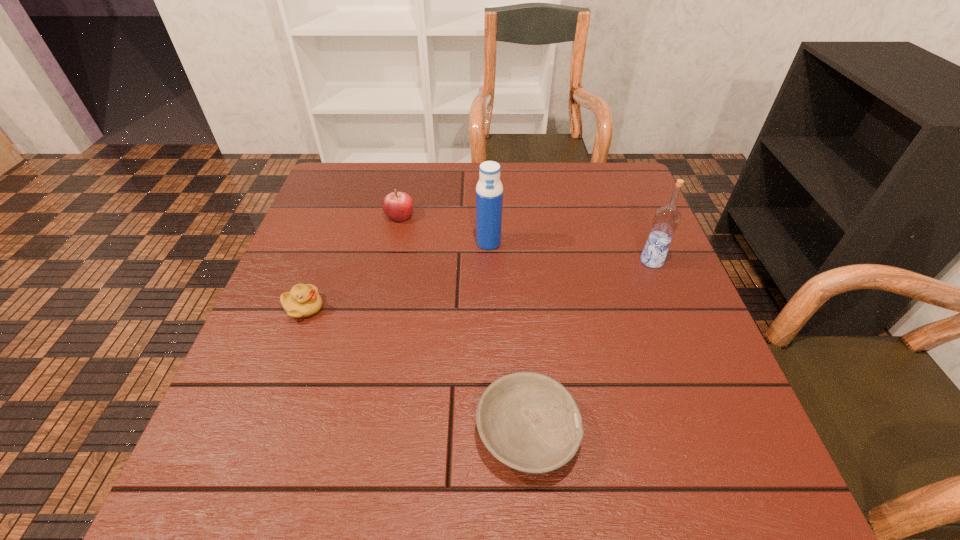
This screenshot has height=540, width=960. I want to click on vacant space located on the right of the water bottle, so click(x=609, y=243).

Where is `vacant region located on the front of the second object from left to right`? The height and width of the screenshot is (540, 960). vacant region located on the front of the second object from left to right is located at coordinates (394, 242).

Where is `vacant area situated 0.090m on the front-facing side of the second nearest object`? The width and height of the screenshot is (960, 540). vacant area situated 0.090m on the front-facing side of the second nearest object is located at coordinates click(365, 308).

The height and width of the screenshot is (540, 960). What are the coordinates of `free region located on the left of the shortest object` in the screenshot? It's located at (371, 433).

The image size is (960, 540). Identify the location of object present at the far edge. (398, 206).

The height and width of the screenshot is (540, 960). Find the location of `object positioned at the near edge`. object positioned at the near edge is located at coordinates (530, 422).

Locate an element on the screen. The width and height of the screenshot is (960, 540). object at the left edge is located at coordinates (303, 300).

This screenshot has height=540, width=960. What are the coordinates of `object that is positioned at the right edge` in the screenshot? It's located at (666, 220).

In the image, there is a desktop. In order to click on blank space at the far edge in this screenshot , I will do `click(449, 167)`.

Identify the location of vacant space at the near edge. This screenshot has width=960, height=540. (457, 453).